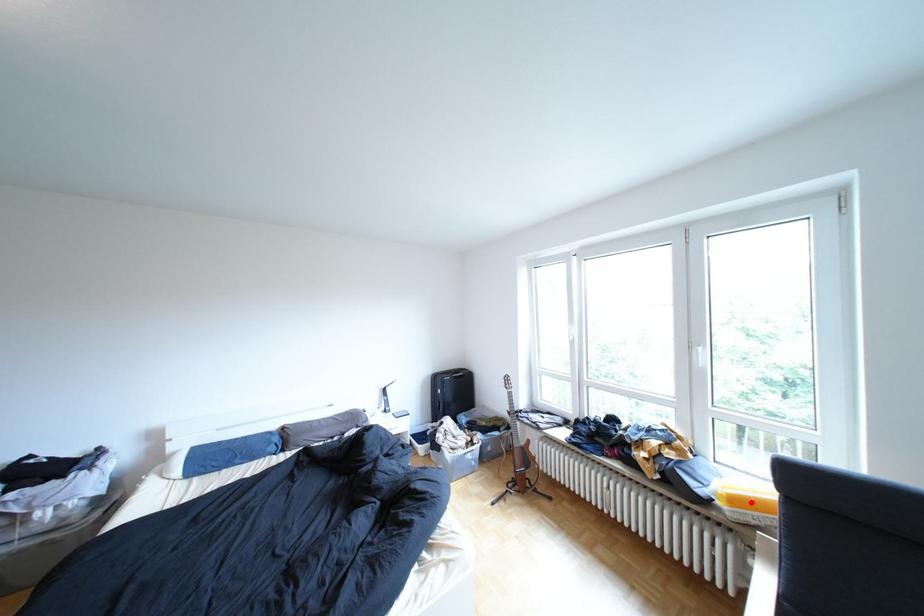
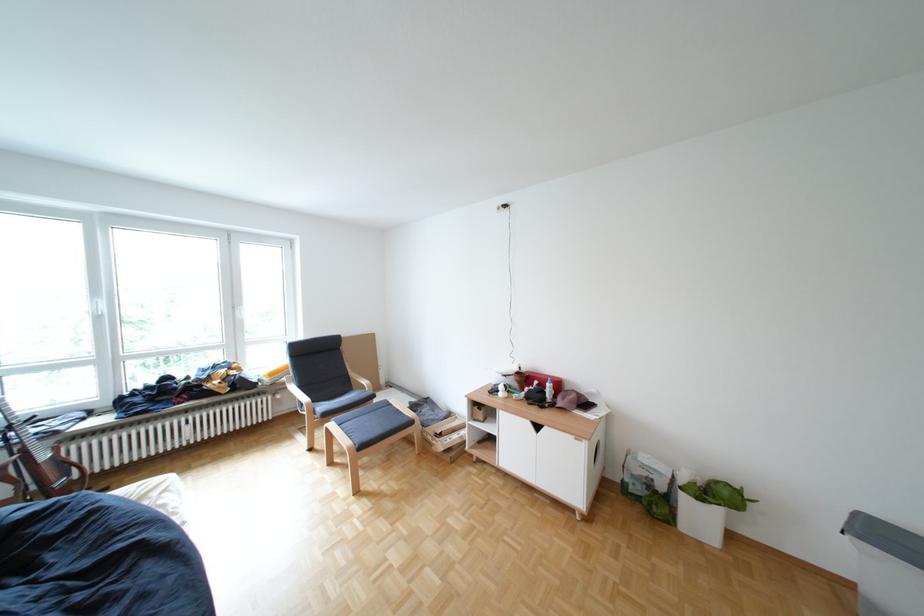
Question: I am providing you with two images of the same scene from different viewpoints. In image1, a red point is highlighted. Considering the same 3D point in image2, which of the following is correct?

Choices:
 (A) It is closer
 (B) It is farther

Answer: (B)